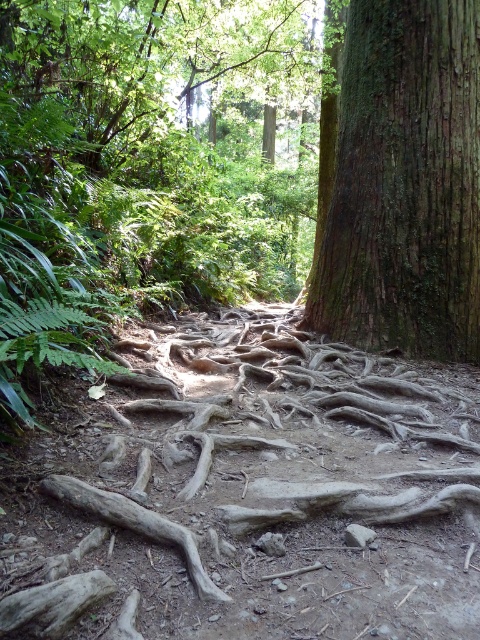
You are a hiker walking along the dirt path in the forest scene. You see the green rough bark tree trunk at center and the brown rough tree root at lower left. Which object is positioned more to the east if you are facing north?

The green rough bark tree trunk at center is positioned more to the east than the brown rough tree root at lower left because it is to the right of it, and since you are facing north, right would be east.

You are a hiker trying to navigate through the forest path. You notice the green rough bark tree trunk at center and the brown rough tree root at lower left. Which object would you need to step over if you are walking along the path?

The brown rough tree root at lower left is smaller in size compared to the green rough bark tree trunk at center, so you would need to step over the brown rough tree root at lower left since it is lower to the ground and part of the path.

You are a hiker trying to navigate through the forest. You see the green rough bark tree trunk at center and the brown rough tree root at lower left. Which one is taller?

The green rough bark tree trunk at center is taller than the brown rough tree root at lower left.